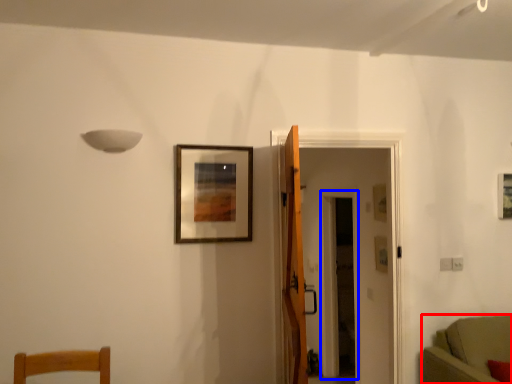
Question: Which object appears farthest to the camera in this image, furniture (highlighted by a red box) or glass door (highlighted by a blue box)?

Choices:
 (A) furniture
 (B) glass door

Answer: (B)